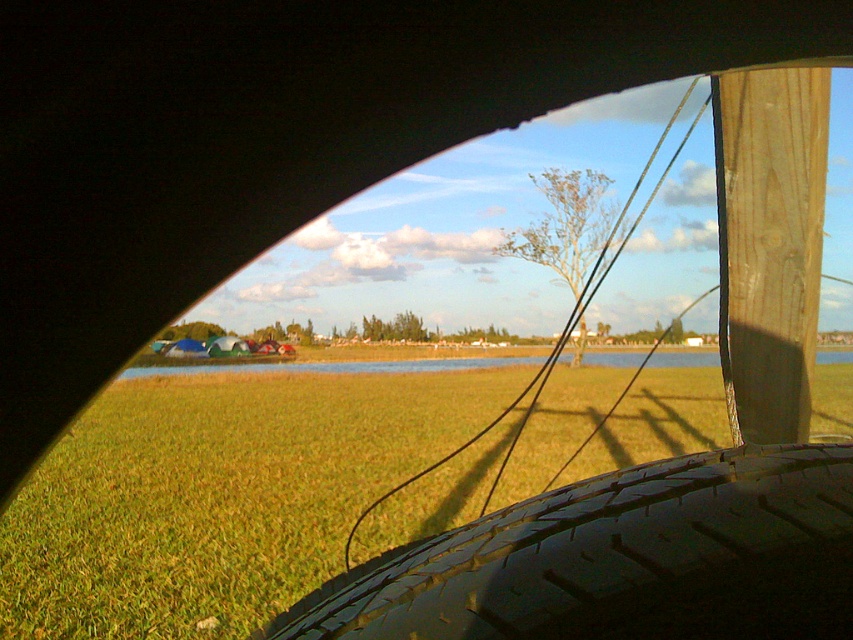
Question: From the image, what is the correct spatial relationship of green grass at lower left in relation to wooden post at upper right?

Choices:
 (A) left
 (B) right

Answer: (B)

Question: Can you confirm if black rubber tire at lower right is positioned above wooden post at upper right?

Choices:
 (A) yes
 (B) no

Answer: (B)

Question: Which of the following is the closest to the observer?

Choices:
 (A) (287, 461)
 (B) (773, 588)

Answer: (B)

Question: Which object appears farthest from the camera in this image?

Choices:
 (A) green grass at lower left
 (B) black rubber tire at lower right
 (C) wooden post at upper right

Answer: (C)

Question: Is black rubber tire at lower right in front of wooden post at upper right?

Choices:
 (A) yes
 (B) no

Answer: (A)

Question: Among these objects, which one is farthest from the camera?

Choices:
 (A) black rubber tire at lower right
 (B) green grass at lower left

Answer: (B)